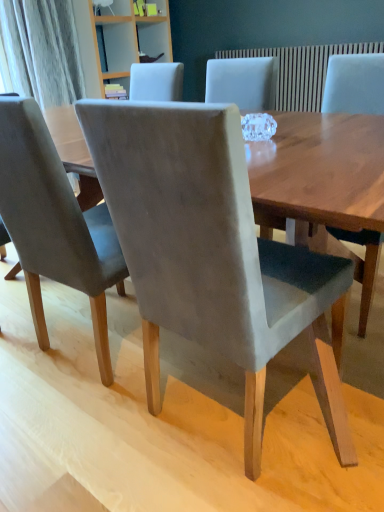
Locate an element on the screen. This screenshot has width=384, height=512. blank area beneath suede gray chair at center, acting as the third chair starting from the right (from a real-world perspective) is located at coordinates (92, 345).